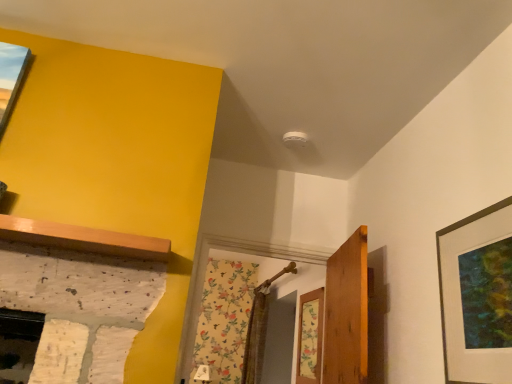
What do you see at coordinates (310, 337) in the screenshot? This screenshot has height=384, width=512. I see `floral wallpaper at center` at bounding box center [310, 337].

The height and width of the screenshot is (384, 512). Find the location of `matte black picture frame at right`. matte black picture frame at right is located at coordinates (477, 296).

This screenshot has height=384, width=512. In order to click on floral wallpaper at center in this screenshot , I will do `click(310, 337)`.

Is matte black picture frame at right next to wooden door at center?

There is a gap between matte black picture frame at right and wooden door at center.

Choose the correct answer: Is matte black picture frame at right inside wooden door at center or outside it?

matte black picture frame at right is not enclosed by wooden door at center.

Can you confirm if matte black picture frame at right is wider than wooden door at center?

No, matte black picture frame at right is not wider than wooden door at center.

Who is shorter, floral wallpaper at center or matte black picture frame at right?

matte black picture frame at right is shorter.

In the image, is floral wallpaper at center positioned in front of or behind matte black picture frame at right?

floral wallpaper at center is positioned farther from the viewer than matte black picture frame at right.

Is floral wallpaper at center facing away from matte black picture frame at right?

No.

From the image's perspective, between wooden door at center and floral wallpaper at center, who is located below?

floral wallpaper at center, from the image's perspective.

Is wooden door at center positioned before floral wallpaper at center?

Yes, the depth of wooden door at center is less than that of floral wallpaper at center.

Is wooden door at center positioned beyond the bounds of floral wallpaper at center?

That's correct, wooden door at center is outside of floral wallpaper at center.

From the picture: Does wooden door at center have a smaller size compared to floral wallpaper at center?

No.

From a real-world perspective, between matte black picture frame at right and floral wallpaper at center, who is vertically higher?

matte black picture frame at right, from a real-world perspective.

Between matte black picture frame at right and floral wallpaper at center, which one has less height?

Standing shorter between the two is matte black picture frame at right.

Is floral wallpaper at center completely or partially inside matte black picture frame at right?

No, floral wallpaper at center is not a part of matte black picture frame at right.

From the image's perspective, which object appears higher, floral wallpaper at center or wooden door at center?

wooden door at center.

Is wooden door at center at the back of floral wallpaper at center?

That's not correct — floral wallpaper at center is not looking away from wooden door at center.

Is floral wallpaper at center thinner than wooden door at center?

Yes.

Can you confirm if floral wallpaper at center is bigger than wooden door at center?

Incorrect, floral wallpaper at center is not larger than wooden door at center.

Between wooden door at center and matte black picture frame at right, which one appears on the right side from the viewer's perspective?

From the viewer's perspective, matte black picture frame at right appears more on the right side.

Based on their sizes in the image, would you say wooden door at center is bigger or smaller than matte black picture frame at right?

In the image, wooden door at center appears to be larger than matte black picture frame at right.

Based on the photo, from a real-world perspective, is wooden door at center located higher than matte black picture frame at right?

No, from a real-world perspective, wooden door at center is not on top of matte black picture frame at right.

I want to click on door below the matte black picture frame at right (from a real-world perspective), so click(x=346, y=313).

What are the coordinates of `picture frame that appears in front of the floral wallpaper at center` in the screenshot? It's located at (477, 296).

Considering their positions, is floral wallpaper at center positioned closer to wooden door at center than matte black picture frame at right?

floral wallpaper at center lies closer to wooden door at center than the other object.

From the image, which object appears to be farther from matte black picture frame at right, floral wallpaper at center or wooden door at center?

floral wallpaper at center is positioned further to the anchor matte black picture frame at right.

Considering their positions, is matte black picture frame at right positioned further to floral wallpaper at center than wooden door at center?

matte black picture frame at right is further to floral wallpaper at center.

From the image, which object appears to be farther from wooden door at center, matte black picture frame at right or floral wallpaper at center?

The object further to wooden door at center is matte black picture frame at right.

Considering their positions, is wooden door at center positioned further to floral wallpaper at center than matte black picture frame at right?

Based on the image, matte black picture frame at right appears to be further to floral wallpaper at center.

Which object lies further to the anchor point matte black picture frame at right, wooden door at center or floral wallpaper at center?

floral wallpaper at center is positioned further to the anchor matte black picture frame at right.

This screenshot has width=512, height=384. I want to click on door between matte black picture frame at right and floral wallpaper at center along the z-axis, so click(346, 313).